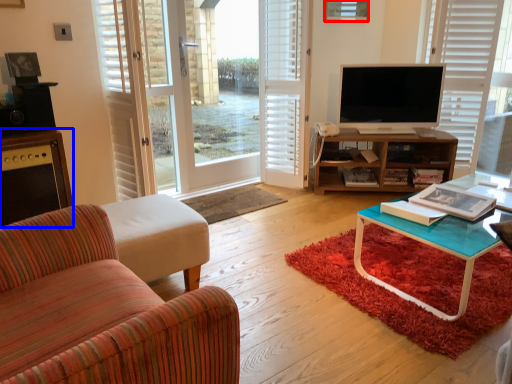
Question: Which of the following is the closest to the observer, picture frame (highlighted by a red box) or cabinetry (highlighted by a blue box)?

Choices:
 (A) picture frame
 (B) cabinetry

Answer: (B)